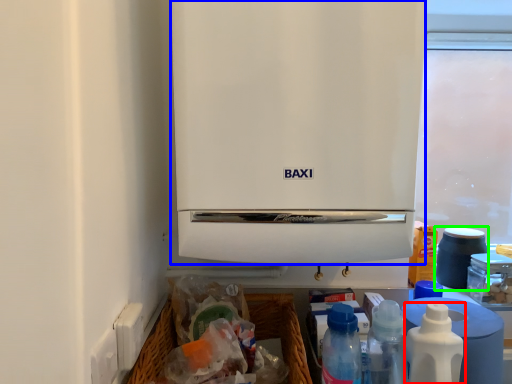
Question: Which object is the farthest from bottle (highlighted by a red box)? Choose among these: home appliance (highlighted by a blue box) or appliance (highlighted by a green box).

Choices:
 (A) home appliance
 (B) appliance

Answer: (B)